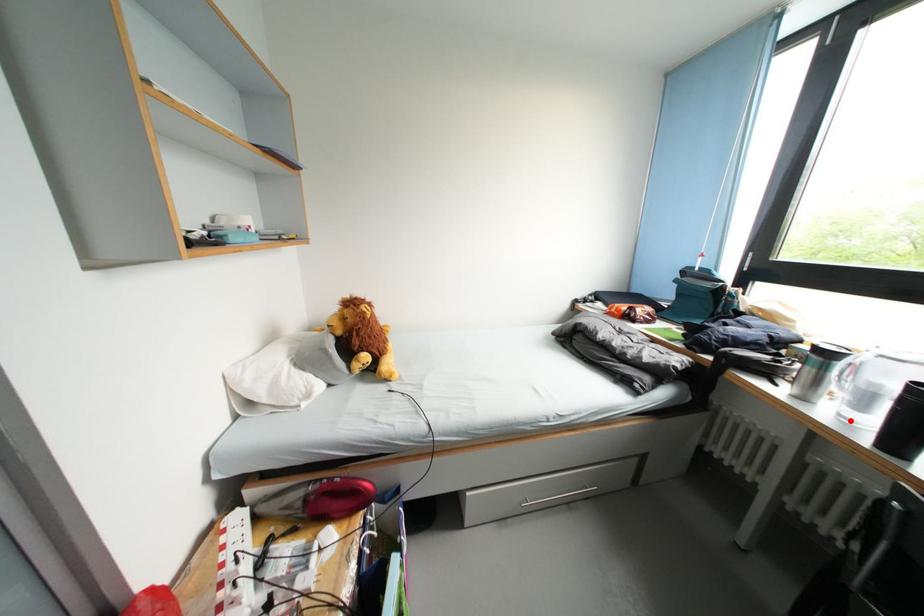
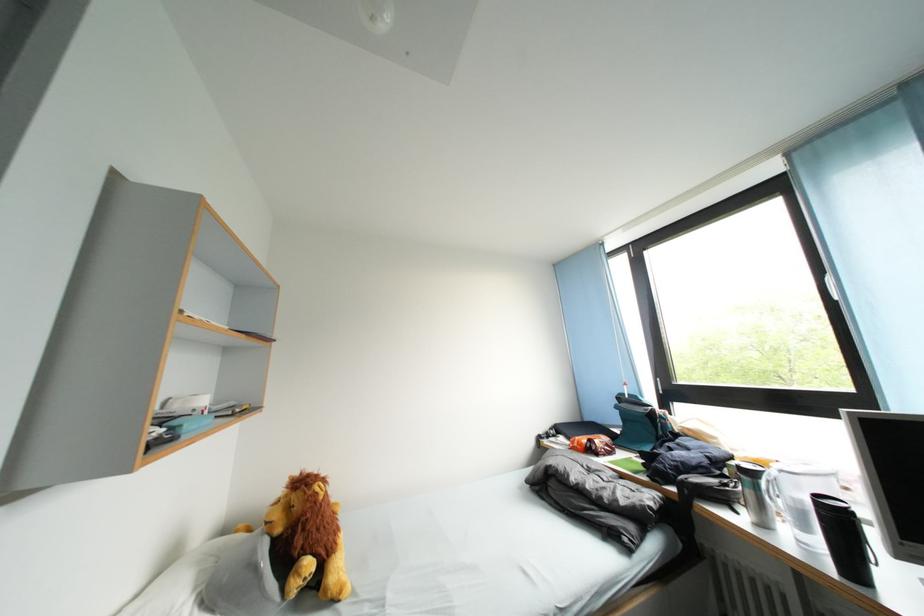
Find the pixel in the second image that matches the highlighted location in the first image.

(808, 546)